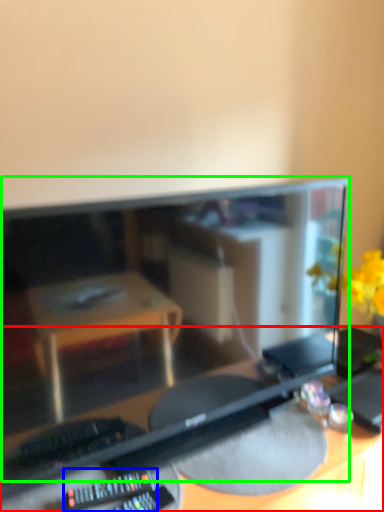
Question: Which is nearer to the desk (highlighted by a red box)? control (highlighted by a blue box) or computer monitor (highlighted by a green box).

Choices:
 (A) control
 (B) computer monitor

Answer: (B)